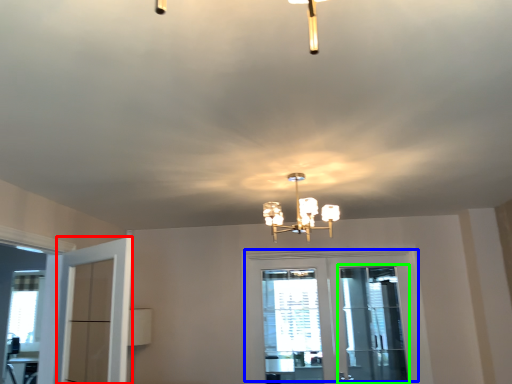
Question: Based on their relative distances, which object is farther from door (highlighted by a red box)? Choose from door (highlighted by a blue box) and screen door (highlighted by a green box).

Choices:
 (A) door
 (B) screen door

Answer: (B)